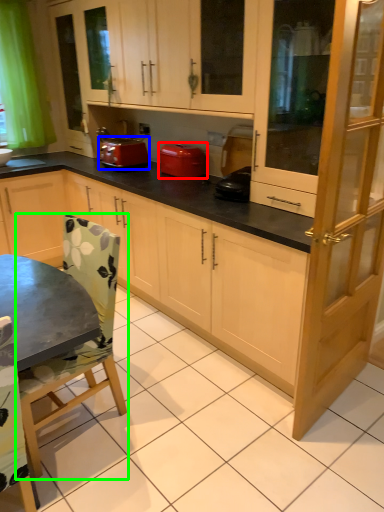
Question: Which object is positioned farthest from home appliance (highlighted by a red box)? Select from kitchen appliance (highlighted by a blue box) and chair (highlighted by a green box).

Choices:
 (A) kitchen appliance
 (B) chair

Answer: (B)